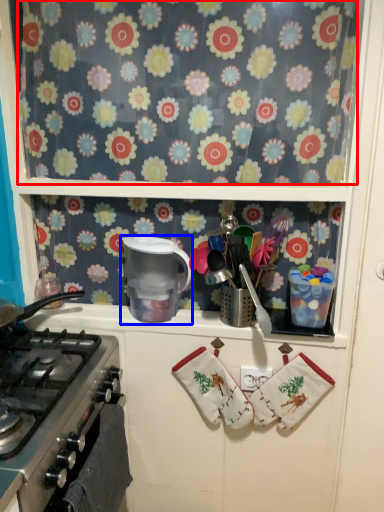
Question: Which object appears closest to the camera in this image, flower (highlighted by a red box) or appliance (highlighted by a blue box)?

Choices:
 (A) flower
 (B) appliance

Answer: (A)